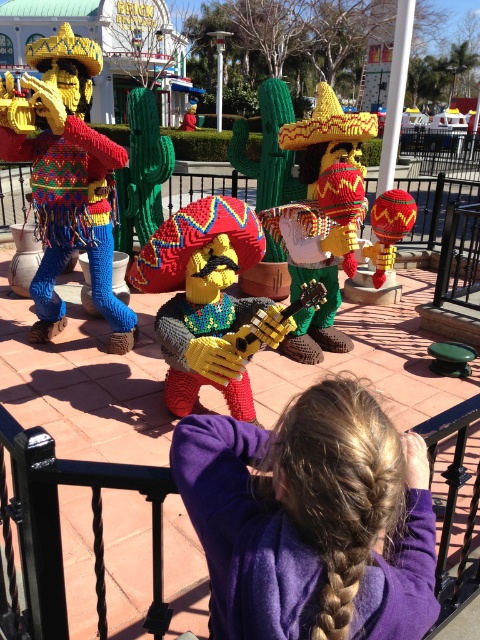
Question: Can you confirm if brick-like guitar at center is bigger than knitted yarn hot air balloon at center?

Choices:
 (A) no
 (B) yes

Answer: (B)

Question: Is knitted yellow hat at center wider than knitted yarn hot air balloon at center?

Choices:
 (A) yes
 (B) no

Answer: (A)

Question: Which of the following is the farthest from the observer?

Choices:
 (A) knitted yarn hot air balloon at center
 (B) brick-like guitar at center

Answer: (A)

Question: Which object is positioned farthest from the knitted yellow hat at center?

Choices:
 (A) multicolored lego figure at left
 (B) brick-like guitar at center
 (C) knitted yarn hot air balloon at center

Answer: (A)

Question: Does multicolored lego figure at left have a smaller size compared to brick-like guitar at center?

Choices:
 (A) yes
 (B) no

Answer: (B)

Question: Considering the real-world distances, which object is closest to the knitted yarn hot air balloon at center?

Choices:
 (A) multicolored lego figure at left
 (B) purple fleece jacket at lower center
 (C) brick-like guitar at center

Answer: (C)